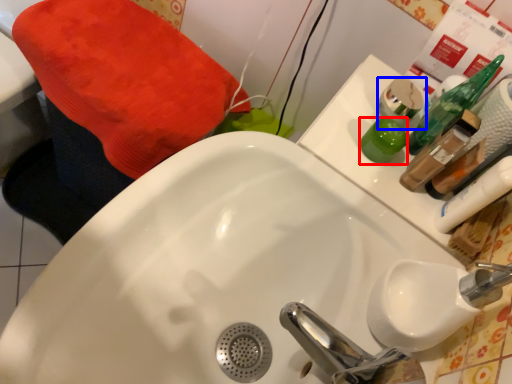
Question: Which object appears farthest to the camera in this image, mouthwash (highlighted by a red box) or mouthwash (highlighted by a blue box)?

Choices:
 (A) mouthwash
 (B) mouthwash

Answer: (B)